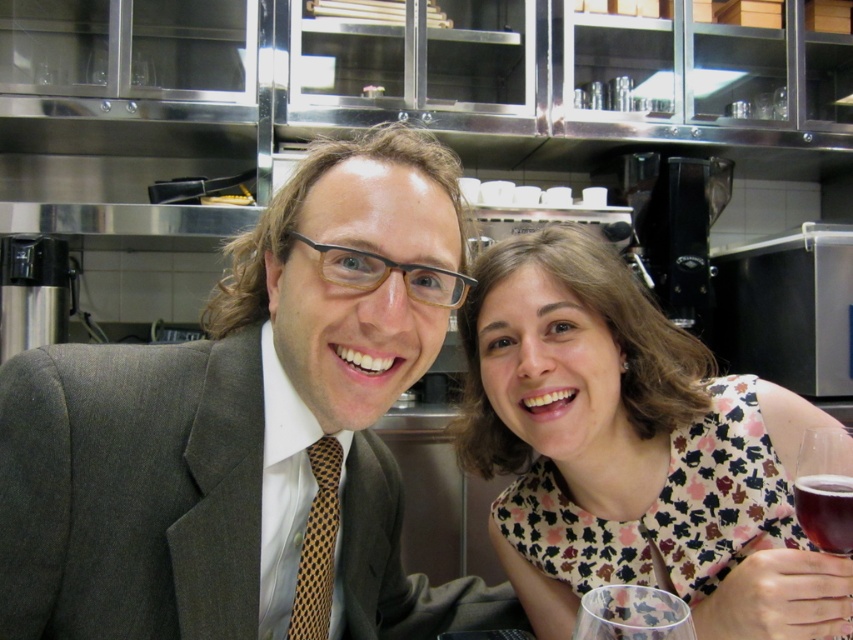
Does matte gray suit at center appear on the left side of dark red liquid at lower right?

Yes, matte gray suit at center is to the left of dark red liquid at lower right.

Between matte gray suit at center and dark red liquid at lower right, which one is positioned lower?

dark red liquid at lower right is below.

The width and height of the screenshot is (853, 640). What do you see at coordinates (245, 428) in the screenshot? I see `matte gray suit at center` at bounding box center [245, 428].

Image resolution: width=853 pixels, height=640 pixels. Identify the location of matte gray suit at center. [x=245, y=428].

Is brown dotted tie at left to the right of translucent glass wine at right from the viewer's perspective?

In fact, brown dotted tie at left is to the left of translucent glass wine at right.

Where is `brown dotted tie at left`? brown dotted tie at left is located at coordinates (317, 545).

Is point (323, 582) closer to camera compared to point (807, 522)?

That is False.

Where is `brown dotted tie at left`? brown dotted tie at left is located at coordinates (317, 545).

Who is lower down, matte gray suit at center or translucent glass wine at right?

matte gray suit at center is lower down.

Between point (199, 464) and point (811, 481), which one is positioned behind?

Point (811, 481)

What are the coordinates of `matte gray suit at center` in the screenshot? It's located at (245, 428).